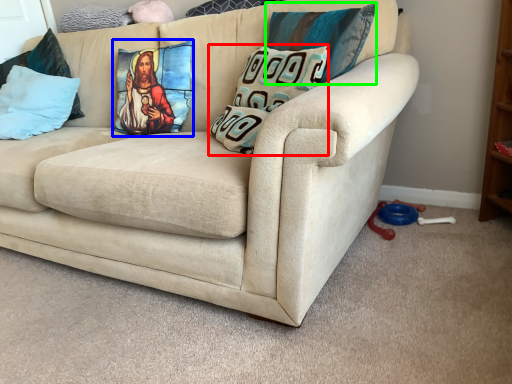
Question: Considering the real-world distances, which object is farthest from pillow (highlighted by a red box)? pillow (highlighted by a blue box) or pillow (highlighted by a green box)?

Choices:
 (A) pillow
 (B) pillow

Answer: (A)